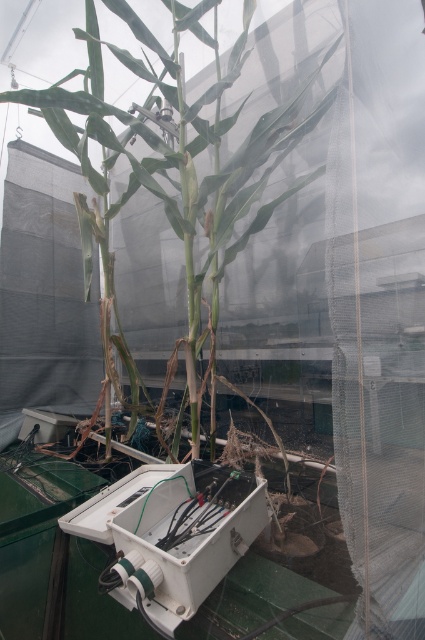
You are a researcher in a greenhouse. You need to place a new sensor on the object that is smaller between the green matte plant at center and the white plastic box at center. Which object should you choose?

The white plastic box at center is smaller than the green matte plant at center, so you should place the new sensor on the white plastic box at center.

You are a researcher in the greenhouse and need to access the white electrical box located at point (209,515). However, you notice there is another point at (65,100) in your way. Can you walk directly to the electrical box without going around?

Point (65,100) is behind point (209,515), so you can walk directly to the white electrical box at point (209,515) without needing to go around since the other point is not blocking your path.